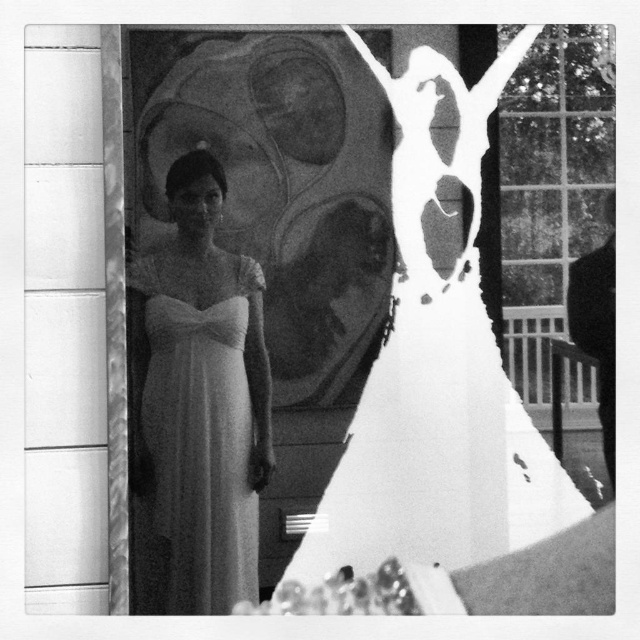
You are a photographer trying to capture a closeup of the transparent glass mirror at upper center and the matte white dress at center. Given that your camera can only focus on objects within 4 inches of each other, will you be able to take a clear photo of both?

The transparent glass mirror at upper center and matte white dress at center are 5.00 inches apart from each other. Since the camera requires objects to be within 4 inches for clear focus, the distance is too great. The photographer cannot take a clear photo of both.

You are standing in the room where the wedding is taking place. You notice a point marked at coordinates (429, 362). What object is located at that point?

The point at (429, 362) marks the transparent glass mirror at upper center.

You are a photographer at a wedding event. You have two dresses in front of you, the satin white dress at center and the matte white dress at center. You need to know if they can fit side by side on a display stand that is 20 centimeters wide. Can they both fit?

The distance between the satin white dress at center and the matte white dress at center is 11.73 centimeters. Since the display stand is 20 centimeters wide, which is wider than the combined width of both dresses, they can fit side by side.